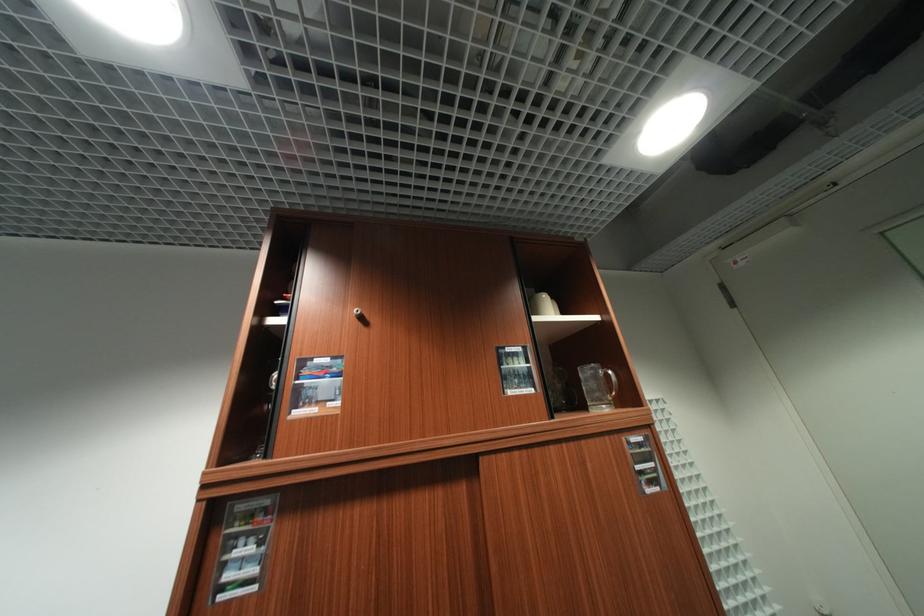
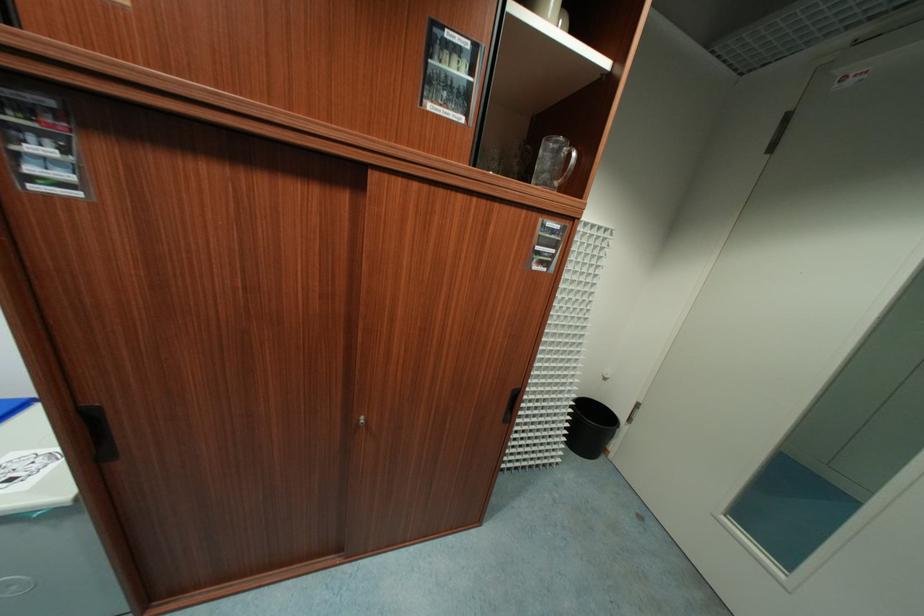
Find the pixel in the second image that matches [613,377] in the first image.

(574, 158)